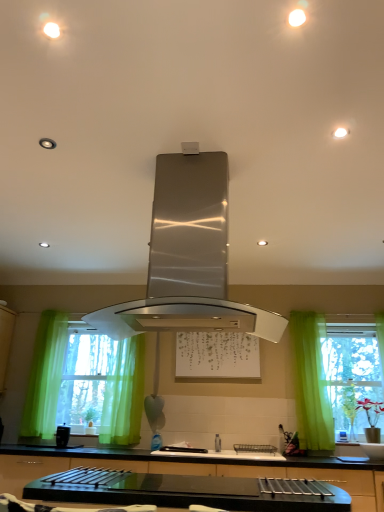
Question: Can you confirm if matte black coffee maker at lower left is shorter than satin nickel faucet at center?

Choices:
 (A) no
 (B) yes

Answer: (A)

Question: Is matte black coffee maker at lower left next to satin nickel faucet at center?

Choices:
 (A) yes
 (B) no

Answer: (B)

Question: Does matte black coffee maker at lower left have a greater height compared to satin nickel faucet at center?

Choices:
 (A) yes
 (B) no

Answer: (A)

Question: From the image's perspective, is matte black coffee maker at lower left beneath satin nickel faucet at center?

Choices:
 (A) no
 (B) yes

Answer: (A)

Question: Is matte black coffee maker at lower left not inside satin nickel faucet at center?

Choices:
 (A) yes
 (B) no

Answer: (A)

Question: From a real-world perspective, is green sheer curtains at left physically located above or below green sheer curtain at right, acting as the first curtain starting from the right?

Choices:
 (A) below
 (B) above

Answer: (A)

Question: Considering the positions of point (96, 372) and point (296, 346), is point (96, 372) closer or farther from the camera than point (296, 346)?

Choices:
 (A) closer
 (B) farther

Answer: (B)

Question: In the image, is green sheer curtains at left on the left side or the right side of green sheer curtain at right, acting as the 2th curtain starting from the left?

Choices:
 (A) left
 (B) right

Answer: (A)

Question: Based on their sizes in the image, would you say green sheer curtains at left is bigger or smaller than green sheer curtain at right, acting as the first curtain starting from the right?

Choices:
 (A) big
 (B) small

Answer: (A)

Question: In the image, is satin nickel faucet at center on the left side or the right side of black glossy countertop at center?

Choices:
 (A) right
 (B) left

Answer: (A)

Question: Is satin nickel faucet at center bigger or smaller than black glossy countertop at center?

Choices:
 (A) small
 (B) big

Answer: (A)

Question: Considering the positions of point (215, 448) and point (8, 449), is point (215, 448) closer or farther from the camera than point (8, 449)?

Choices:
 (A) closer
 (B) farther

Answer: (B)

Question: Is satin nickel faucet at center spatially inside black glossy countertop at center, or outside of it?

Choices:
 (A) outside
 (B) inside

Answer: (A)

Question: Is green sheer curtain at right, acting as the first curtain starting from the right, in front of or behind black glossy countertop at center in the image?

Choices:
 (A) behind
 (B) front

Answer: (A)

Question: Is green sheer curtain at right, acting as the first curtain starting from the right, wider or thinner than black glossy countertop at center?

Choices:
 (A) thin
 (B) wide

Answer: (A)